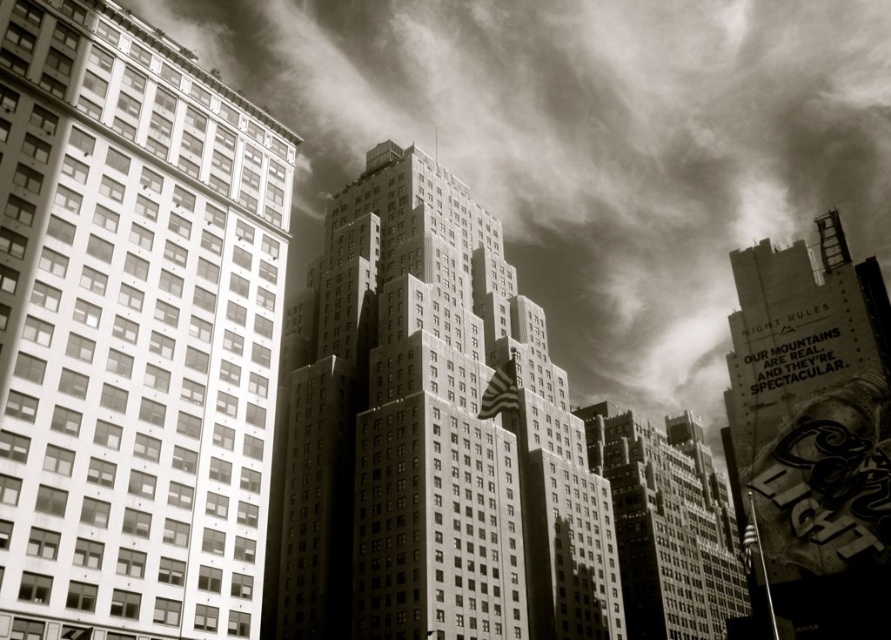
You are an architect analyzing the urban scene. You notice the cloudy sky at upper center and the smooth glass building at left. Which of these two elements occupies a greater horizontal space in the image?

The cloudy sky at upper center occupies a greater horizontal space than the smooth glass building at left because its width is larger.

You are a drone operator planning to fly a drone between the cloudy sky at upper center and the smooth glass building at left. The drone has a maximum flight distance of 1000 feet. Can the drone safely travel between these two points without exceeding its range?

The distance between the cloudy sky at upper center and the smooth glass building at left is 804.12 feet. Since the drone can fly up to 1000 feet, it can safely travel between these two points without exceeding its range.